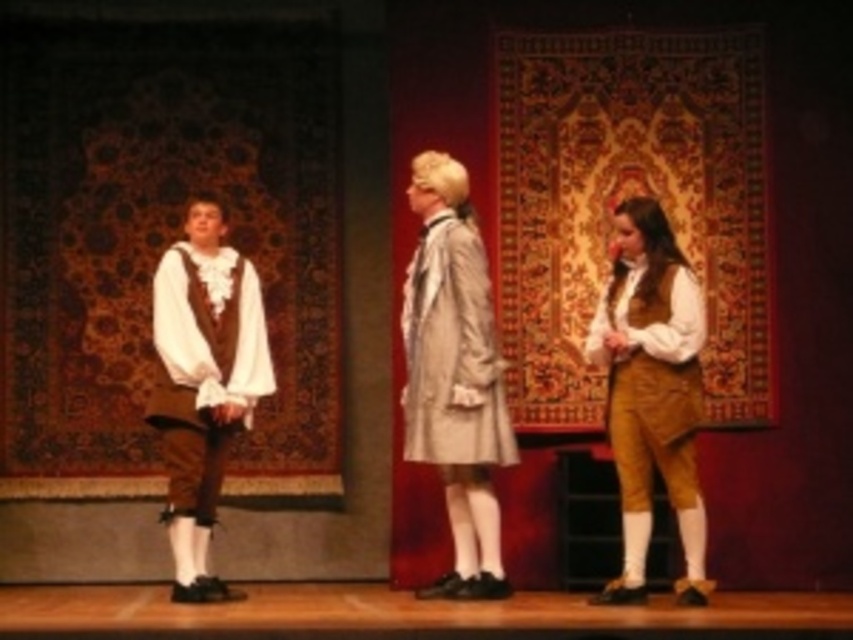
Based on the scene description, which object has a larger size between the matte brown vest at right and the light beige fabric dress at center?

The matte brown vest at right has a larger size compared to the light beige fabric dress at center according to the description.

You are an audience member sitting in the front row of the theater. You notice two items on stage, the matte brown vest at right and the matte white shirt at left. Which item appears taller when viewed from your seat?

The matte brown vest at right appears taller than the matte white shirt at left because the Objects Description states that the matte brown vest at right has a greater height compared to the matte white shirt at left.